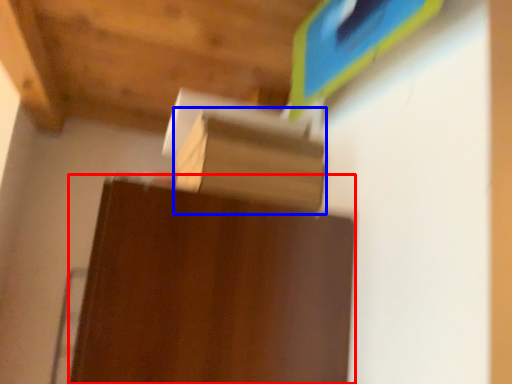
Question: Which point is further to the camera, furniture (highlighted by a red box) or cardboard box (highlighted by a blue box)?

Choices:
 (A) furniture
 (B) cardboard box

Answer: (B)